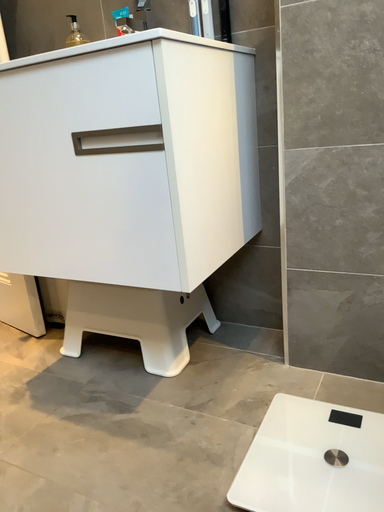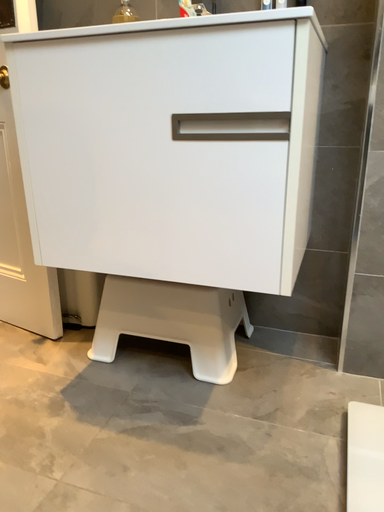
Question: Which way did the camera rotate in the video?

Choices:
 (A) rotated left
 (B) rotated right

Answer: (B)